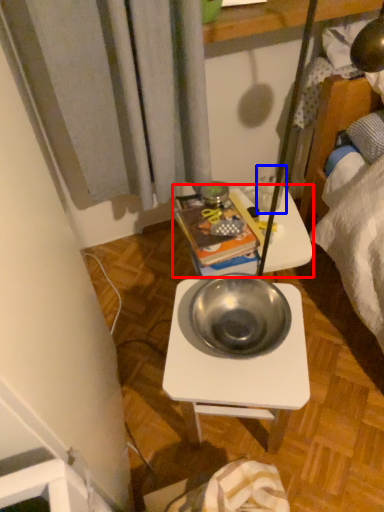
Question: Which point is closer to the camera, table (highlighted by a red box) or coffee cup (highlighted by a blue box)?

Choices:
 (A) table
 (B) coffee cup

Answer: (A)